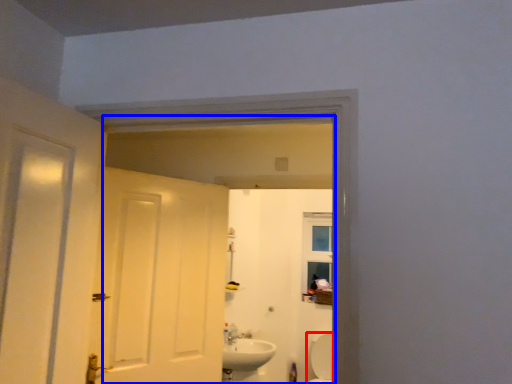
Question: Among these objects, which one is farthest to the camera, bath (highlighted by a red box) or mirror (highlighted by a blue box)?

Choices:
 (A) bath
 (B) mirror

Answer: (A)